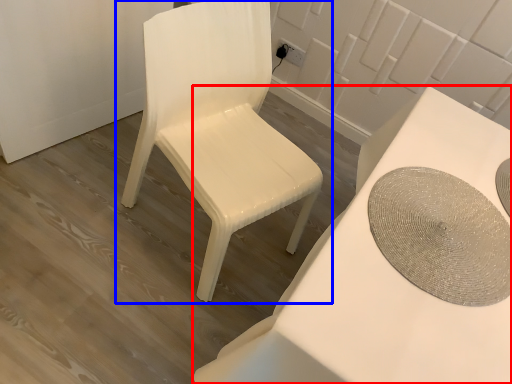
Question: Among these objects, which one is nearest to the camera, table (highlighted by a red box) or chair (highlighted by a blue box)?

Choices:
 (A) table
 (B) chair

Answer: (A)